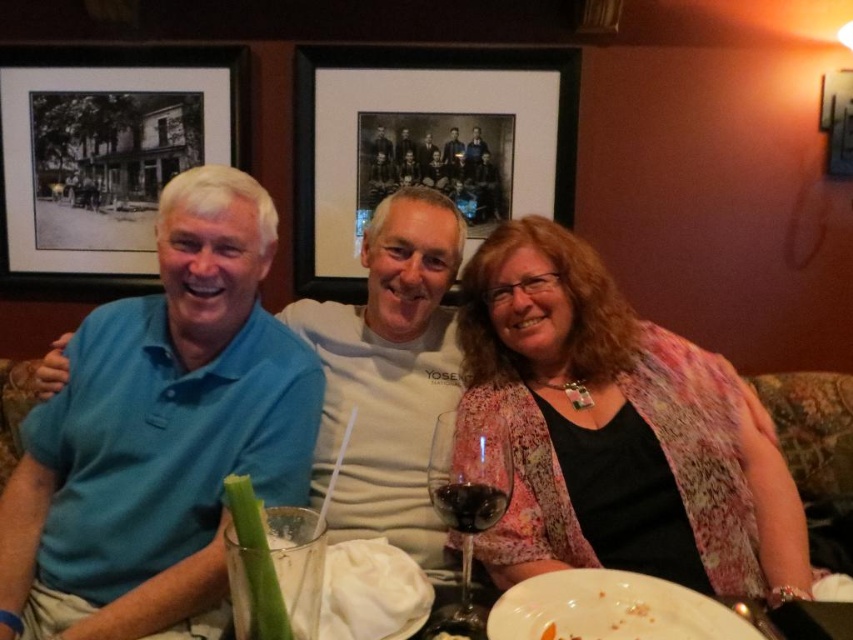
Question: Can you confirm if blue cotton polo shirt at left is positioned to the left of floral-patterned blouse at center?

Choices:
 (A) yes
 (B) no

Answer: (A)

Question: From the image, what is the correct spatial relationship of matte blue shirt at left in relation to transparent glass wine glass at center?

Choices:
 (A) above
 (B) below

Answer: (A)

Question: Which of the following is the farthest from the observer?

Choices:
 (A) (659, 493)
 (B) (210, 280)
 (C) (445, 442)

Answer: (A)

Question: Which point is closer to the camera?

Choices:
 (A) (447, 472)
 (B) (759, 420)
 (C) (218, 404)

Answer: (A)

Question: Which of the following is the closest to the observer?

Choices:
 (A) (485, 484)
 (B) (151, 179)
 (C) (485, 356)
 (D) (381, 163)

Answer: (A)

Question: From the image, what is the correct spatial relationship of black matte picture frame at upper center in relation to dark glass at center?

Choices:
 (A) left
 (B) right

Answer: (A)